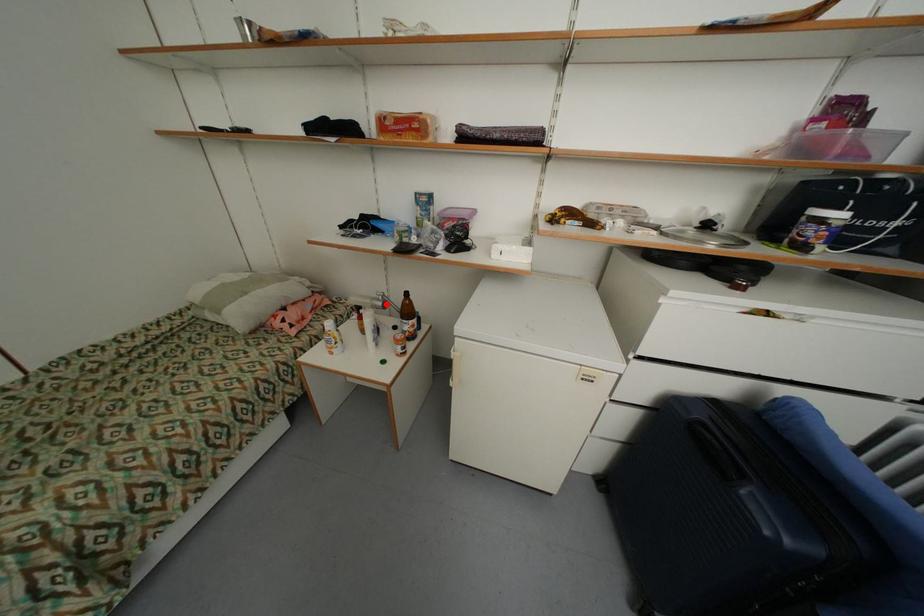
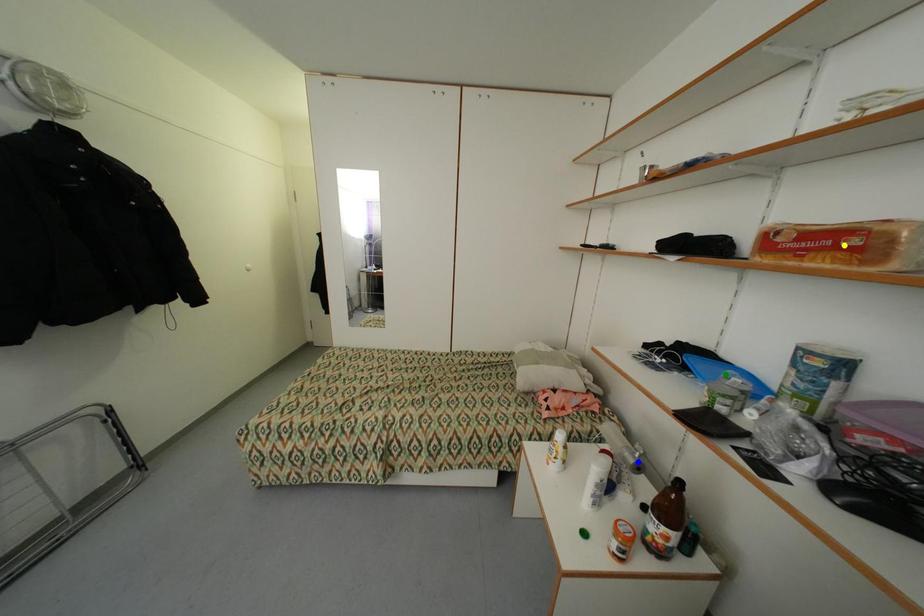
Question: I am providing you with two images of the same scene from different viewpoints. A red point is marked on the first image. You are given multiple points on the second image. Can you choose the point in image 2 that corresponds to the point in image 1?

Choices:
 (A) green point
 (B) yellow point
 (C) blue point

Answer: (C)